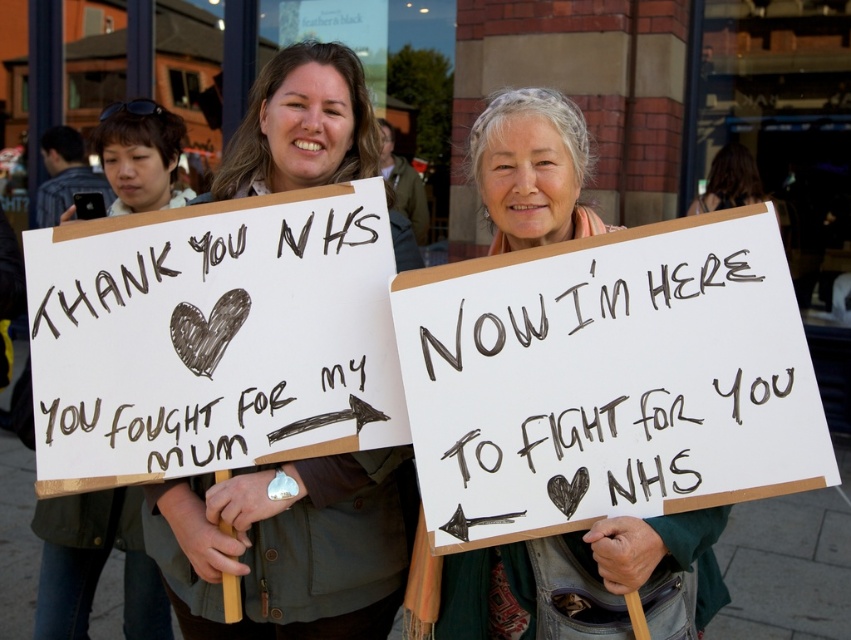
Question: Which point appears closest to the camera in this image?

Choices:
 (A) (450, 620)
 (B) (263, 340)

Answer: (B)

Question: Which object is closer to the camera taking this photo?

Choices:
 (A) matte brown jacket at center
 (B) green fabric scarf at center
 (C) white paper at center

Answer: (B)

Question: Can you confirm if black handwritten text at center is positioned to the right of matte brown jacket at center?

Choices:
 (A) no
 (B) yes

Answer: (B)

Question: Which object is farther from the camera taking this photo?

Choices:
 (A) white paper at center
 (B) black handwritten text at center

Answer: (A)

Question: Can you confirm if white paper at center is positioned below green fabric scarf at center?

Choices:
 (A) no
 (B) yes

Answer: (A)

Question: Does white paper at center appear on the right side of green fabric scarf at center?

Choices:
 (A) yes
 (B) no

Answer: (B)